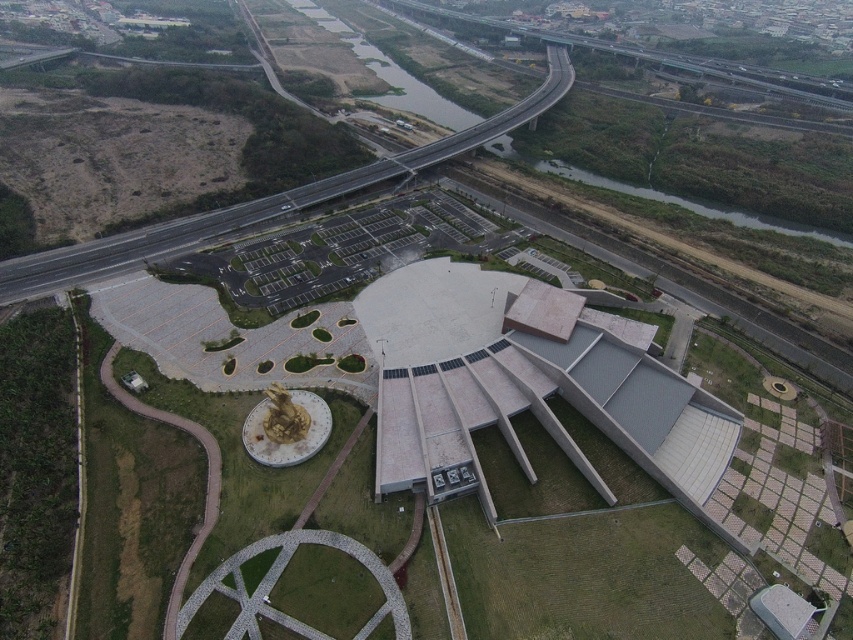
Can you confirm if white concrete building at center is thinner than asphalt road at upper center?

Yes, white concrete building at center is thinner than asphalt road at upper center.

Between point (570, 320) and point (44, 259), which one is positioned behind?

Point (44, 259)

In order to click on white concrete building at center in this screenshot , I will do `click(525, 384)`.